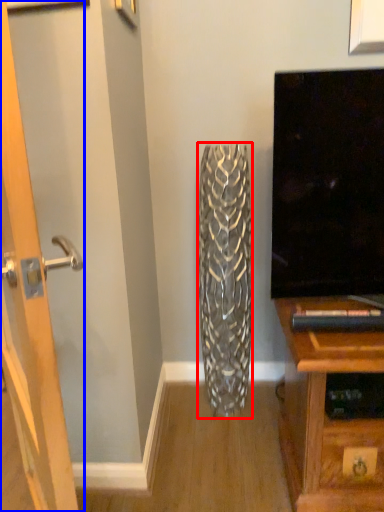
Question: Which point is further to the camera, vase (highlighted by a red box) or door (highlighted by a blue box)?

Choices:
 (A) vase
 (B) door

Answer: (A)